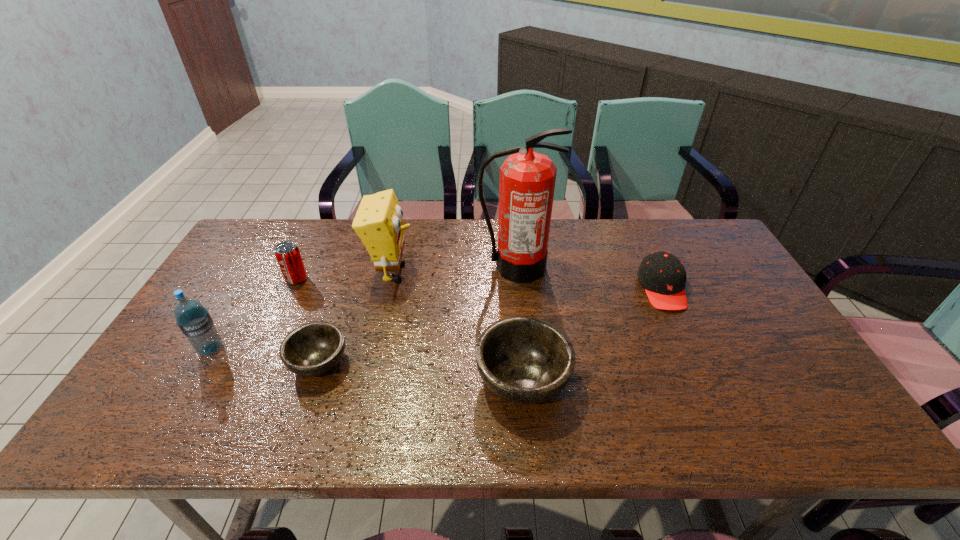
In order to click on vacant region between the soda can and the tallest object in this screenshot , I will do `click(406, 273)`.

Where is `vacant space in between the leftmost object and the taller bowl`? vacant space in between the leftmost object and the taller bowl is located at coordinates (367, 364).

This screenshot has height=540, width=960. In order to click on free space that is in between the left bowl and the sixth object from right to left in this screenshot , I will do `click(308, 321)`.

This screenshot has height=540, width=960. Find the location of `free space between the sponge and the water bottle`. free space between the sponge and the water bottle is located at coordinates (302, 310).

This screenshot has width=960, height=540. Find the location of `vacant region between the tallest object and the soda can`. vacant region between the tallest object and the soda can is located at coordinates (406, 273).

Find the location of a particular element. object that is the closest to the rightmost object is located at coordinates (527, 179).

Locate an element on the screen. object that is the sixth nearest to the water bottle is located at coordinates (663, 276).

Find the location of `free space that satisfies the following two spatial constraints: 1. on the back side of the fifth shortest object; 2. on the left side of the fourth shortest object`. free space that satisfies the following two spatial constraints: 1. on the back side of the fifth shortest object; 2. on the left side of the fourth shortest object is located at coordinates (252, 280).

Where is `free region that satisfies the following two spatial constraints: 1. on the face of the sixth shortest object; 2. on the back side of the taller bowl`? Image resolution: width=960 pixels, height=540 pixels. free region that satisfies the following two spatial constraints: 1. on the face of the sixth shortest object; 2. on the back side of the taller bowl is located at coordinates (369, 380).

Where is `vacant space that satisfies the following two spatial constraints: 1. on the front side of the taller bowl; 2. on the left side of the sixth object from right to left`? The height and width of the screenshot is (540, 960). vacant space that satisfies the following two spatial constraints: 1. on the front side of the taller bowl; 2. on the left side of the sixth object from right to left is located at coordinates tap(250, 380).